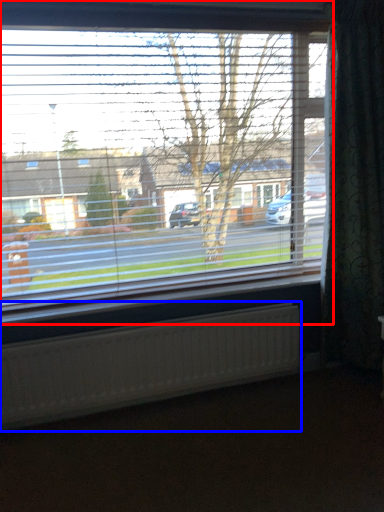
Question: Which point is further to the camera, window (highlighted by a red box) or radiator (highlighted by a blue box)?

Choices:
 (A) window
 (B) radiator

Answer: (B)